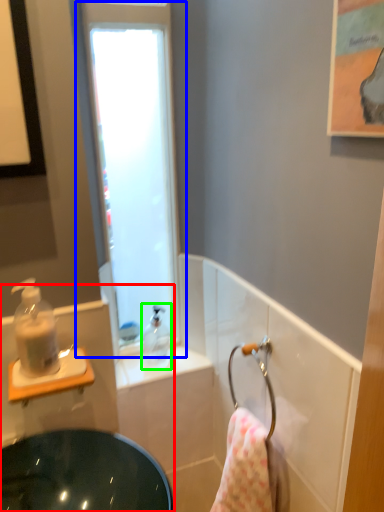
Question: Estimate the real-world distances between objects in this image. Which object is closer to sink (highlighted by a red box), window (highlighted by a blue box) or soap dispenser (highlighted by a green box)?

Choices:
 (A) window
 (B) soap dispenser

Answer: (B)